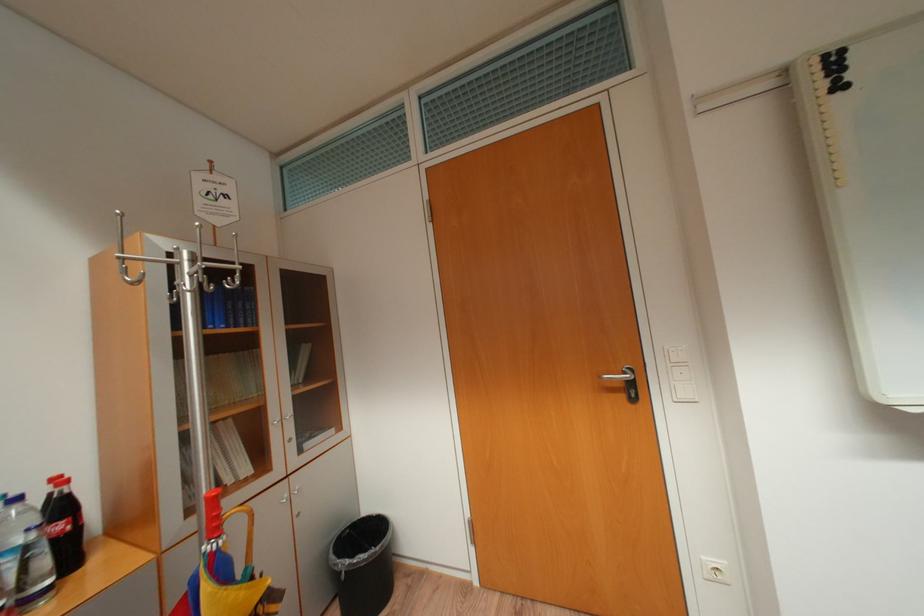
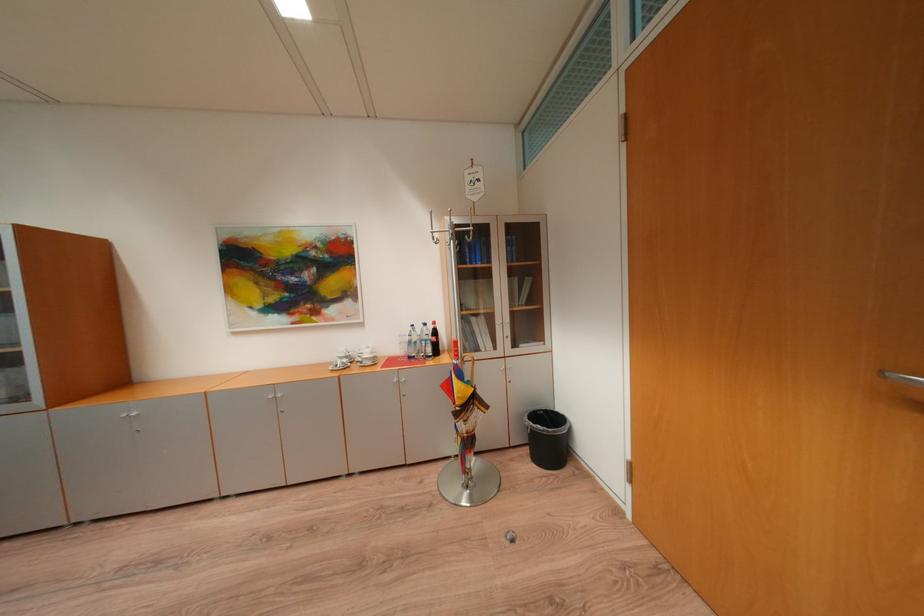
Question: The camera is either moving clockwise (left) or counter-clockwise (right) around the object. The first image is from the beginning of the video and the second image is from the end. Is the camera moving left or right when shooting the video?

Choices:
 (A) Left
 (B) Right

Answer: (B)